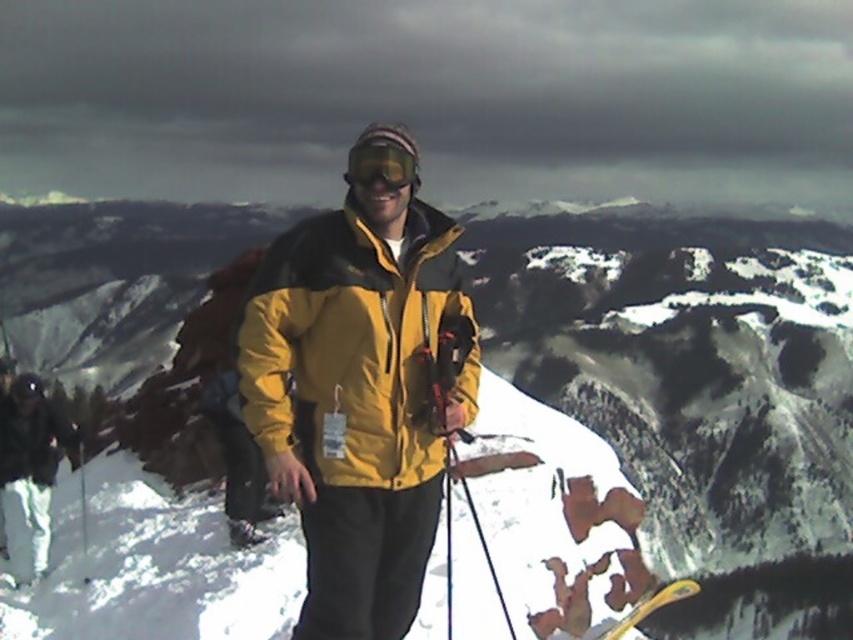
Question: Where is yellow matte jacket at center located in relation to green matte goggles at center in the image?

Choices:
 (A) left
 (B) right

Answer: (B)

Question: Does green matte goggles at center appear over yellow plastic ski at center?

Choices:
 (A) yes
 (B) no

Answer: (A)

Question: Among these points, which one is farthest from the camera?

Choices:
 (A) (322, 356)
 (B) (376, 148)
 (C) (663, 602)

Answer: (C)

Question: Which point appears closest to the camera in this image?

Choices:
 (A) (409, 150)
 (B) (694, 592)
 (C) (415, 428)

Answer: (C)

Question: Estimate the real-world distances between objects in this image. Which object is closer to the green matte goggles at center?

Choices:
 (A) yellow plastic ski at center
 (B) yellow matte jacket at center

Answer: (B)

Question: Is yellow matte jacket at center below green matte goggles at center?

Choices:
 (A) yes
 (B) no

Answer: (A)